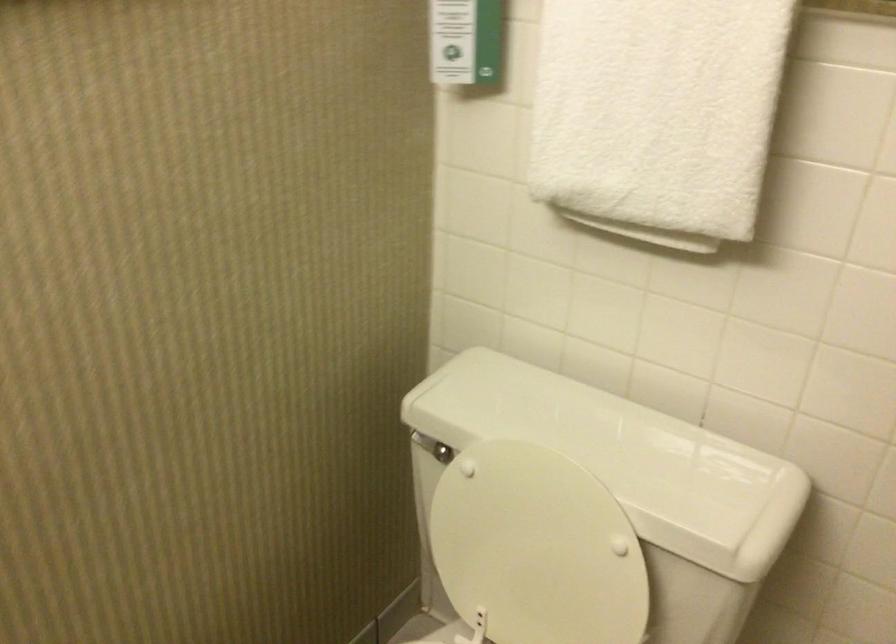
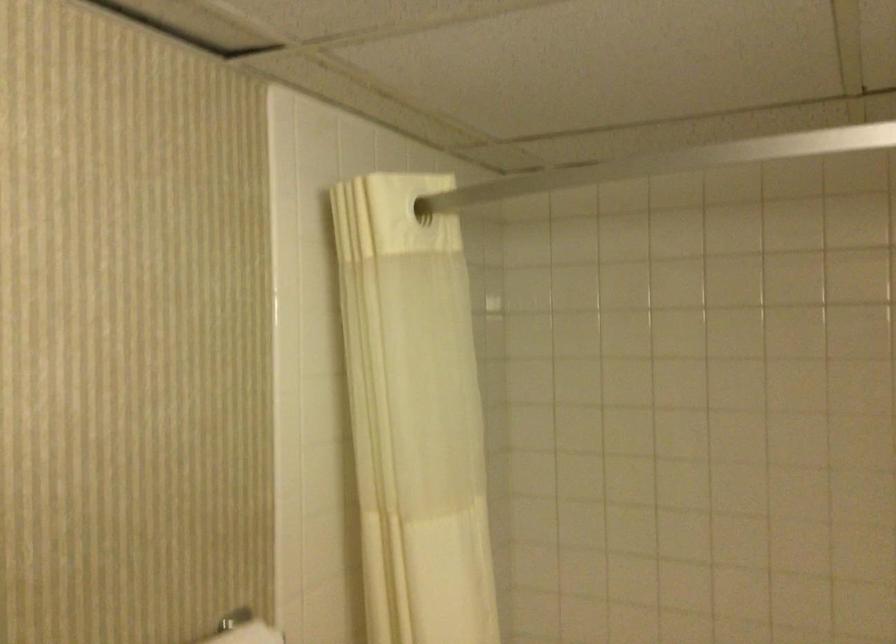
Question: The images are taken continuously from a first-person perspective. In which direction is your viewpoint rotating?

Choices:
 (A) Left
 (B) Right
 (C) Up
 (D) Down

Answer: (B)